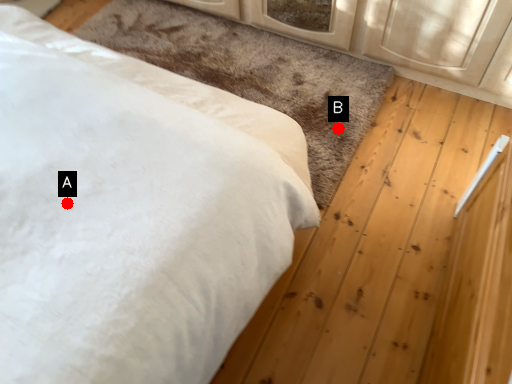
Question: Two points are circled on the image, labeled by A and B beside each circle. Which point appears farthest from the camera in this image?

Choices:
 (A) A is further
 (B) B is further

Answer: (B)